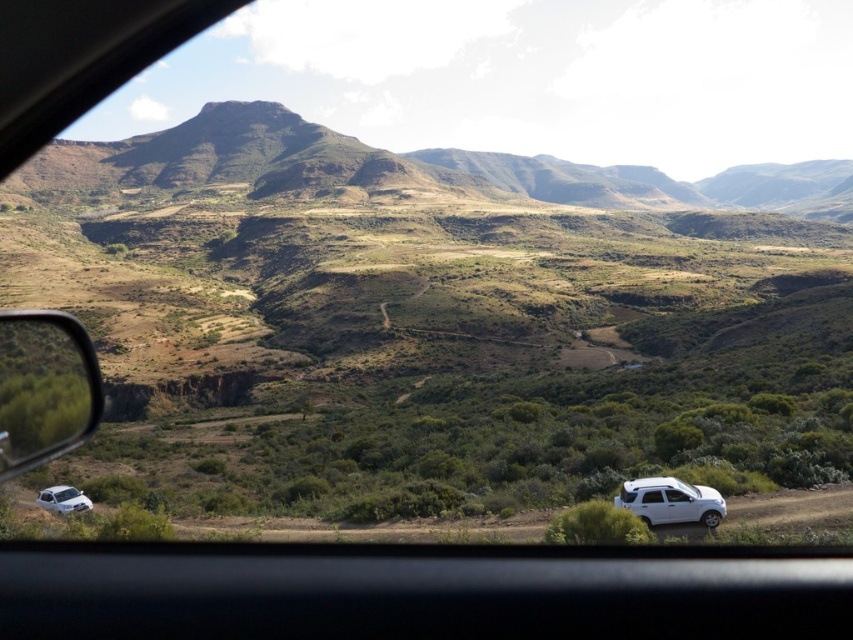
Does metallic side mirror at left appear on the right side of white matte suv at lower left?

Incorrect, metallic side mirror at left is not on the right side of white matte suv at lower left.

Is point (68, 436) closer to viewer compared to point (49, 509)?

Yes.

Is point (7, 320) positioned in front of point (56, 496)?

Yes, it is.

Identify the location of metallic side mirror at left. The height and width of the screenshot is (640, 853). (44, 388).

Who is lower down, white matte suv at lower right or white matte suv at lower left?

white matte suv at lower left is lower down.

Who is more forward, (646,490) or (64,500)?

Point (646,490) is more forward.

The height and width of the screenshot is (640, 853). I want to click on white matte suv at lower right, so click(670, 500).

Is metallic side mirror at left further to the viewer compared to white matte suv at lower right?

No, metallic side mirror at left is closer to the viewer.

Can you confirm if metallic side mirror at left is positioned above white matte suv at lower right?

Correct, metallic side mirror at left is located above white matte suv at lower right.

Who is more forward, (53, 424) or (646, 524)?

Positioned in front is point (53, 424).

Image resolution: width=853 pixels, height=640 pixels. I want to click on metallic side mirror at left, so click(44, 388).